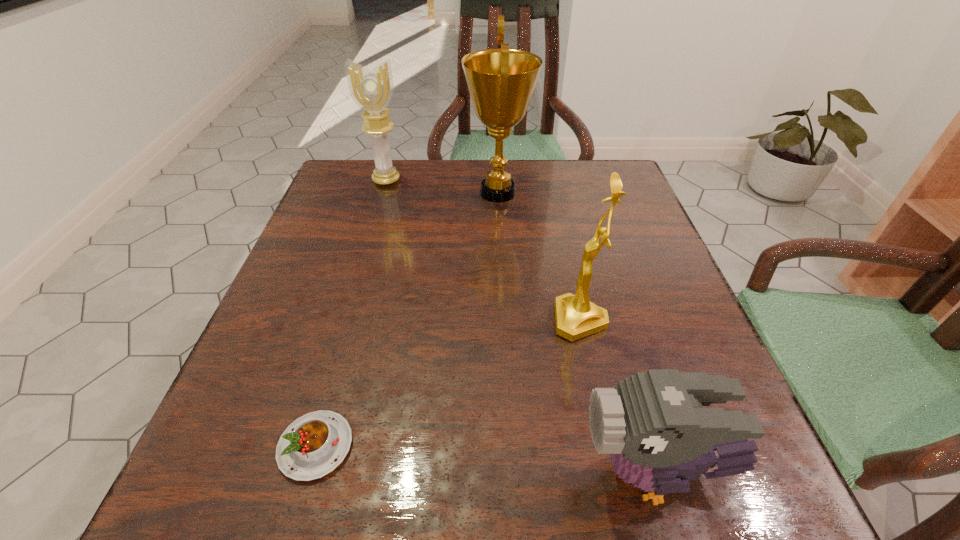
Locate an element on the screen. The height and width of the screenshot is (540, 960). object that ranks as the fourth closest to the bird is located at coordinates (371, 90).

Identify the location of object that can be found as the closest to the second shortest object. This screenshot has height=540, width=960. point(576,317).

Point out which award is positioned as the nearest to the leftmost award. Please provide its 2D coordinates. Your answer should be formatted as a tuple, i.e. [(x, y)], where the tuple contains the x and y coordinates of a point satisfying the conditions above.

[(501, 81)]

Where is `the closest award to the leftmost award`? the closest award to the leftmost award is located at coordinates (501, 81).

Find the location of a particular element. blank area in the image that satisfies the following two spatial constraints: 1. on the front-facing side of the leftmost award; 2. on the right side of the shortest object is located at coordinates (307, 446).